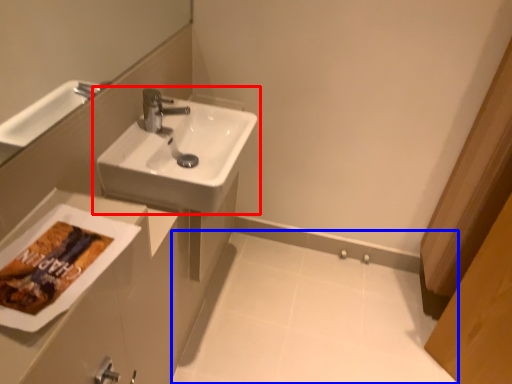
Question: Among these objects, which one is farthest to the camera, sink (highlighted by a red box) or porcelain (highlighted by a blue box)?

Choices:
 (A) sink
 (B) porcelain

Answer: (B)